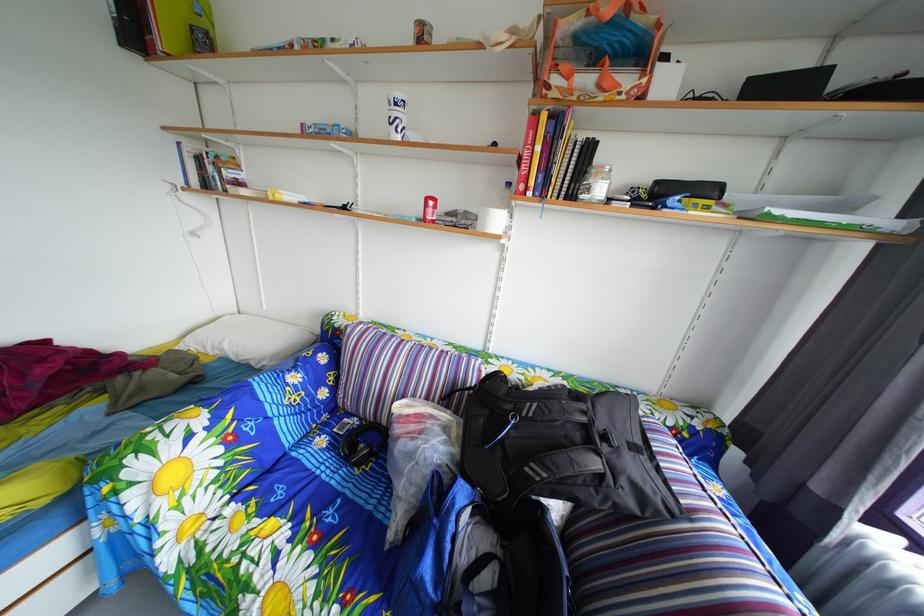
Where is `black plastic buckle`? Image resolution: width=924 pixels, height=616 pixels. black plastic buckle is located at coordinates (641, 451).